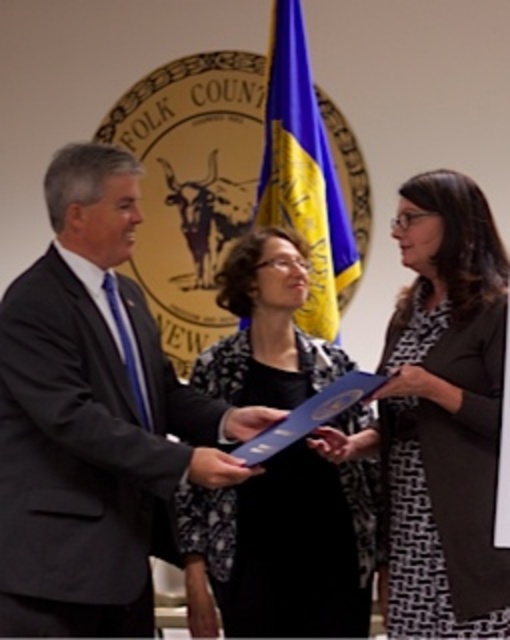
You are an event photographer at the Folk County award ceremony. You notice the matte blue paper at center and the matte blue folder at center. Which object is closer to the camera?

The matte blue paper at center is positioned over the matte blue folder at center, so it is closer to the camera.

You are an event photographer at the Folk County ceremony. You need to capture a closeup shot of both the black textured scarf at center and the blue paper at center. Which object should you focus on first if you want to ensure both are in frame without moving the camera?

The black textured scarf at center might be wider than blue paper at center, so focusing on the wider object first would help ensure both are in frame without moving the camera.

You are attending the Folk County award ceremony and notice two items at the center of the scene. The black textured dress at center and the black textured scarf at center. Which one is positioned to the right?

The black textured dress at center is positioned to the right of the black textured scarf at center.